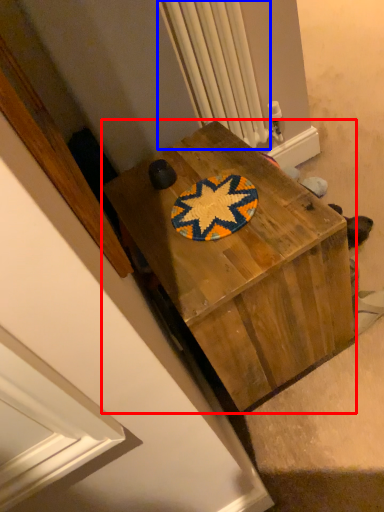
Question: Among these objects, which one is nearest to the camera, desk (highlighted by a red box) or radiator (highlighted by a blue box)?

Choices:
 (A) desk
 (B) radiator

Answer: (A)